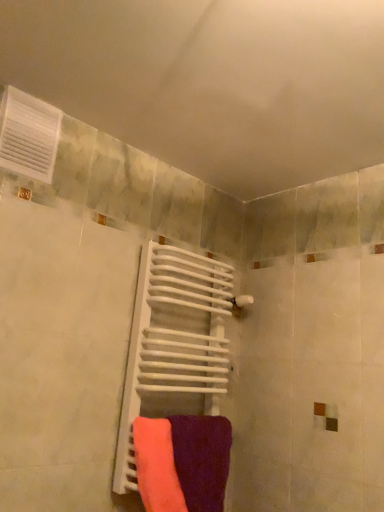
Question: Based on their positions, is white plastic vent at upper left located to the left or right of purple matte towel at center, the 2th towel when ordered from left to right?

Choices:
 (A) left
 (B) right

Answer: (A)

Question: Is white plastic vent at upper left spatially inside purple matte towel at center, the first towel when ordered from right to left, or outside of it?

Choices:
 (A) outside
 (B) inside

Answer: (A)

Question: Which is nearer to the purple matte towel at center, the 2th towel when ordered from left to right?

Choices:
 (A) white plastic vent at upper left
 (B) neon pink fabric at center, which ranks as the 1th towel in left-to-right order
 (C) white matte radiator at center

Answer: (B)

Question: Which of these objects is positioned farthest from the purple matte towel at center, the 2th towel when ordered from left to right?

Choices:
 (A) white plastic vent at upper left
 (B) white matte radiator at center
 (C) neon pink fabric at center, which ranks as the 1th towel in left-to-right order

Answer: (A)